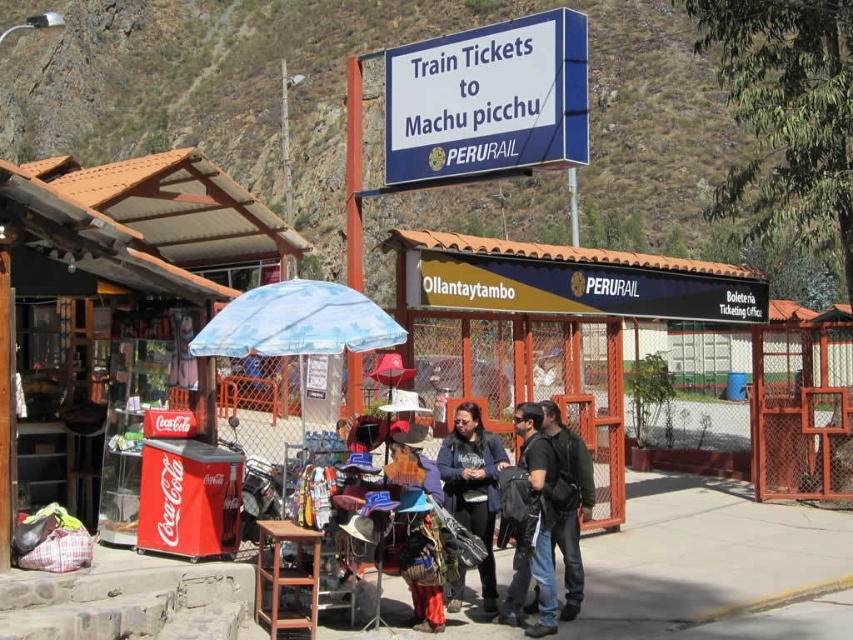
Can you confirm if dark blue jeans at center is shorter than dark blue jacket at center?

Incorrect, dark blue jeans at center's height does not fall short of dark blue jacket at center's.

Who is higher up, dark blue jeans at center or dark blue jacket at center?

Positioned higher is dark blue jacket at center.

Does point (517, 433) come in front of point (461, 444)?

That is False.

Where is `dark blue jeans at center`? dark blue jeans at center is located at coordinates (532, 525).

The width and height of the screenshot is (853, 640). What do you see at coordinates (573, 280) in the screenshot?
I see `yellow corrugated metal at center` at bounding box center [573, 280].

Measure the distance between yellow corrugated metal at center and dark blue jacket at center.

They are 2.94 meters apart.

Is point (468, 236) closer to viewer compared to point (450, 492)?

No, it is not.

The height and width of the screenshot is (640, 853). In order to click on yellow corrugated metal at center in this screenshot , I will do `click(573, 280)`.

Can you confirm if blue printed fabric umbrella at center is thinner than dark gray fabric jacket at center?

No.

Is blue printed fabric umbrella at center above dark gray fabric jacket at center?

Indeed, blue printed fabric umbrella at center is positioned over dark gray fabric jacket at center.

Is point (271, 333) positioned in front of point (581, 563)?

Yes, it is.

At what (x,y) coordinates should I click in order to perform the action: click on blue printed fabric umbrella at center. Please return your answer as a coordinate pair (x, y). This screenshot has width=853, height=640. Looking at the image, I should click on (297, 323).